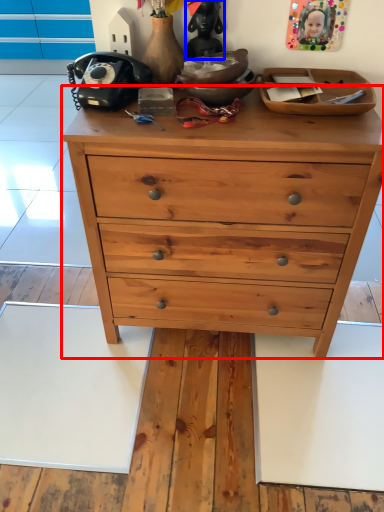
Question: Which of the following is the closest to the observer, chest of drawers (highlighted by a red box) or toy (highlighted by a blue box)?

Choices:
 (A) chest of drawers
 (B) toy

Answer: (A)